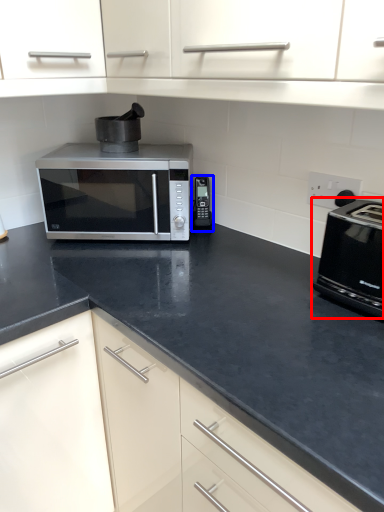
Question: Which object appears farthest to the camera in this image, toaster (highlighted by a red box) or appliance (highlighted by a blue box)?

Choices:
 (A) toaster
 (B) appliance

Answer: (B)